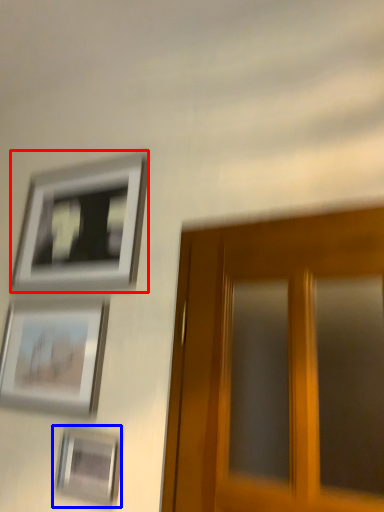
Question: Which point is closer to the camera, picture frame (highlighted by a red box) or picture frame (highlighted by a blue box)?

Choices:
 (A) picture frame
 (B) picture frame

Answer: (B)